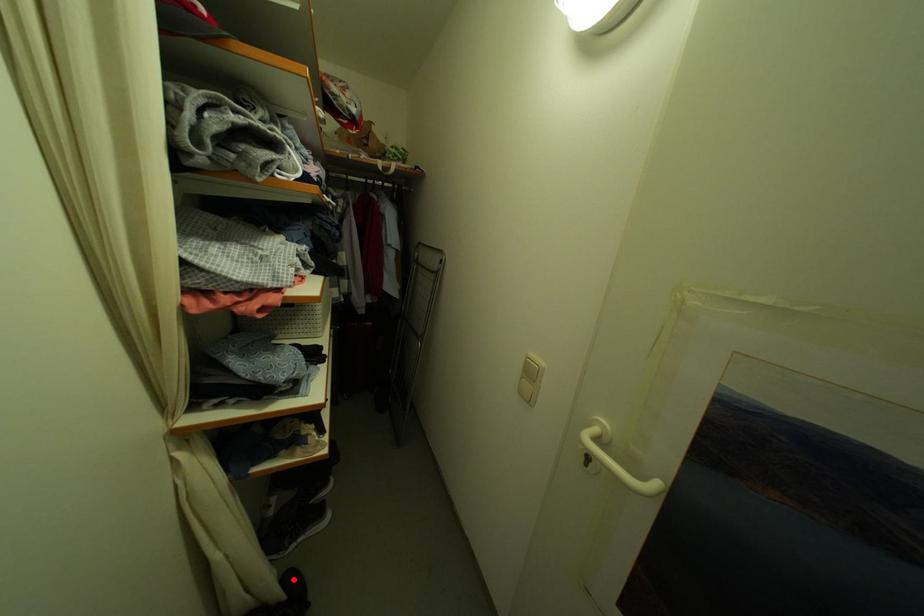
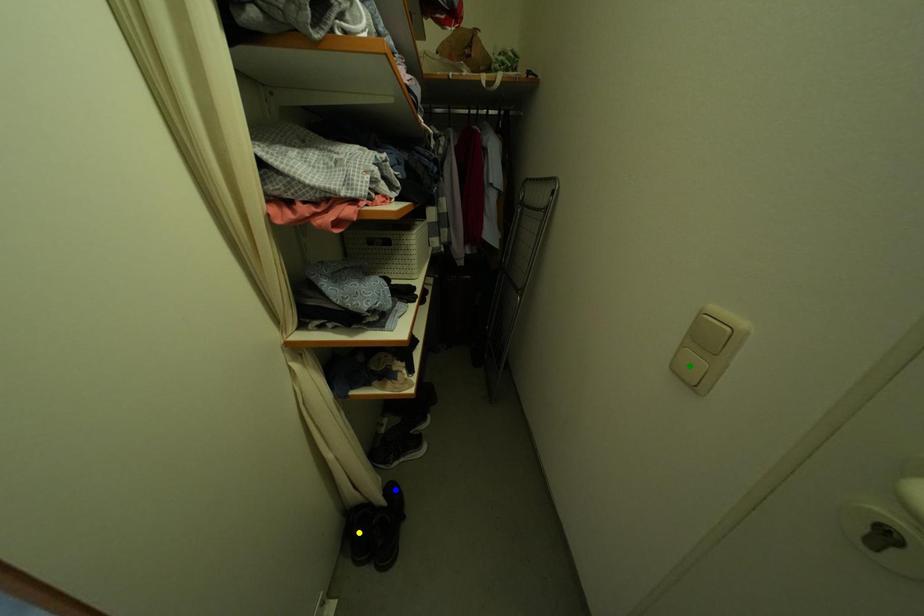
Question: I am providing you with two images of the same scene from different viewpoints. A red point is marked on the first image. You are given multiple points on the second image. Which point in image 2 is actually the same real-world point as the red point in image 1?

Choices:
 (A) green point
 (B) blue point
 (C) yellow point

Answer: (B)